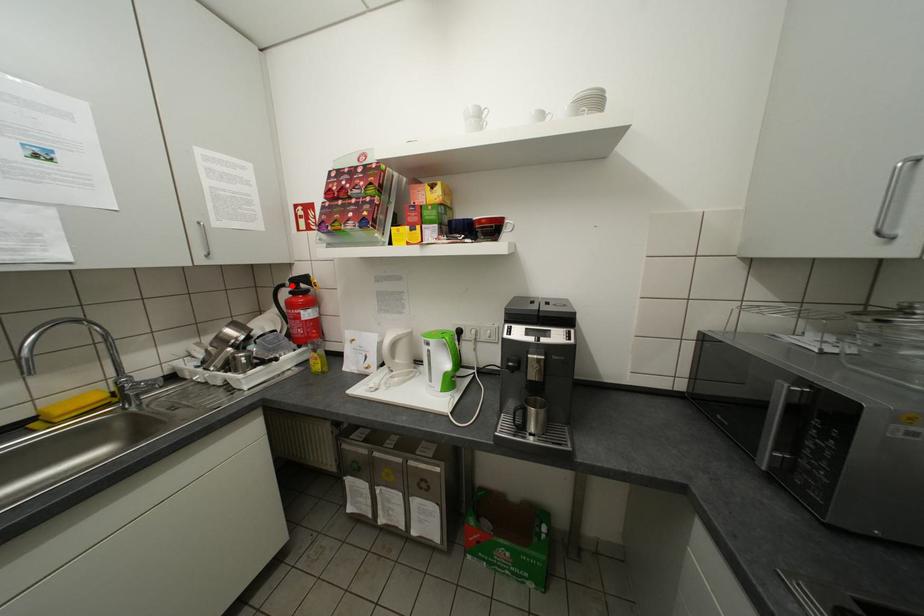
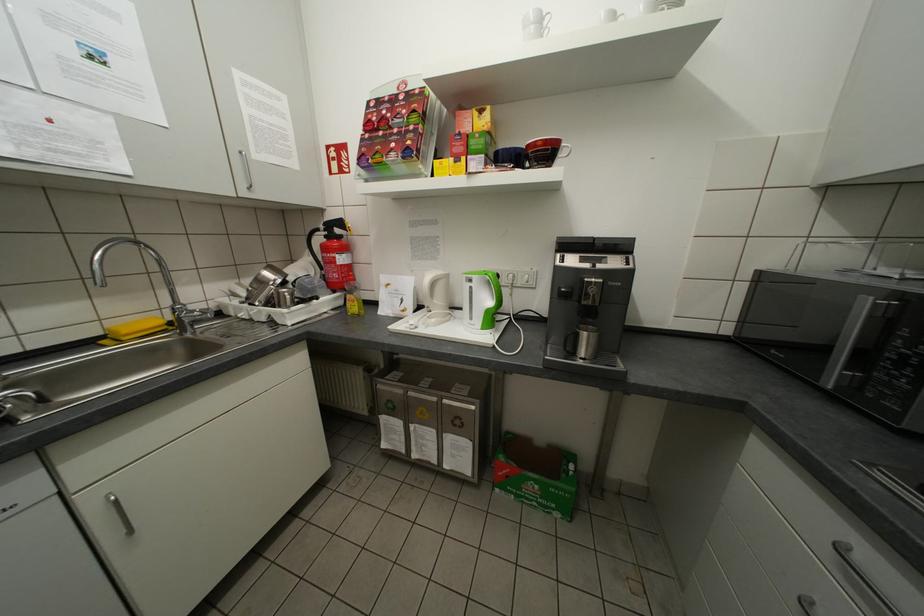
In the second image, find the point that corresponds to the highlighted location in the first image.

(325, 230)